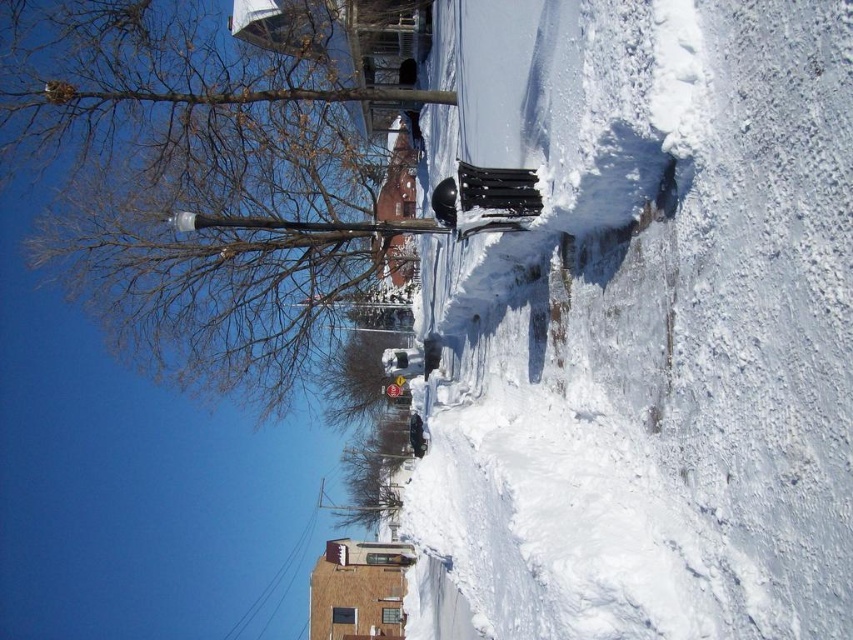
Question: Which object is farther from the camera taking this photo?

Choices:
 (A) black plastic trash can at center
 (B) brown bark tree at upper left

Answer: (B)

Question: From the image, what is the correct spatial relationship of black plastic trash can at center in relation to brown bark tree at upper left?

Choices:
 (A) right
 (B) left

Answer: (A)

Question: Which point is closer to the camera?

Choices:
 (A) black plastic trash can at center
 (B) brown bark tree at upper left

Answer: (A)

Question: Observing the image, what is the correct spatial positioning of black plastic trash can at center in reference to brown bark tree at upper left?

Choices:
 (A) above
 (B) below

Answer: (B)

Question: Which object appears farthest from the camera in this image?

Choices:
 (A) black plastic trash can at center
 (B) brown bark tree at upper left

Answer: (B)

Question: In this image, where is black plastic trash can at center located relative to brown bark tree at upper left?

Choices:
 (A) above
 (B) below

Answer: (B)